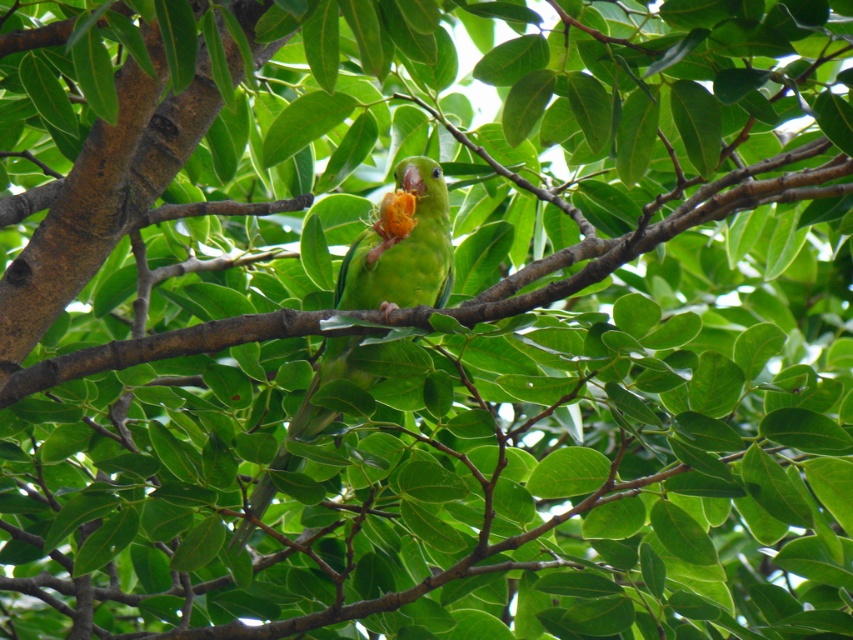
Question: Which of the following is the farthest from the observer?

Choices:
 (A) brown rough tree branch at center
 (B) green matte parrot at center

Answer: (B)

Question: Which point appears farthest from the camera in this image?

Choices:
 (A) (259, 339)
 (B) (392, 227)

Answer: (B)

Question: Is brown rough tree branch at center smaller than green matte parrot at center?

Choices:
 (A) yes
 (B) no

Answer: (B)

Question: Can you confirm if brown rough tree branch at center is smaller than green matte parrot at center?

Choices:
 (A) no
 (B) yes

Answer: (A)

Question: Which object appears farthest from the camera in this image?

Choices:
 (A) green matte parrot at center
 (B) brown rough tree branch at center

Answer: (A)

Question: Does brown rough tree branch at center have a smaller size compared to green matte parrot at center?

Choices:
 (A) no
 (B) yes

Answer: (A)